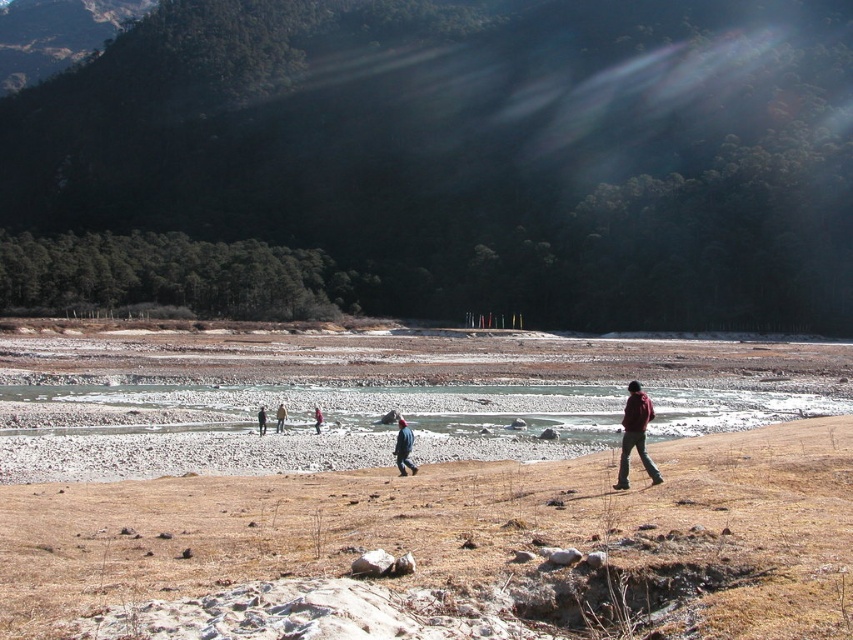
Can you confirm if brown dry grass at lower center is positioned above denim jacket at center?

Yes.

Who is shorter, brown dry grass at lower center or denim jacket at center?

brown dry grass at lower center

Where is `brown dry grass at lower center`? brown dry grass at lower center is located at coordinates (448, 548).

Which is in front, point (419, 499) or point (321, 424)?

Point (419, 499) is more forward.

Which is in front, point (514, 602) or point (318, 419)?

Point (514, 602) is in front.

In order to click on brown dry grass at lower center in this screenshot , I will do `click(448, 548)`.

Measure the distance from denim jacket at center to red woolen jacket at center.

denim jacket at center is 9.70 meters from red woolen jacket at center.

Who is shorter, denim jacket at center or red woolen jacket at center?

red woolen jacket at center

Is point (405, 467) in front of point (315, 428)?

Yes, point (405, 467) is closer to viewer.

The image size is (853, 640). I want to click on denim jacket at center, so click(x=403, y=449).